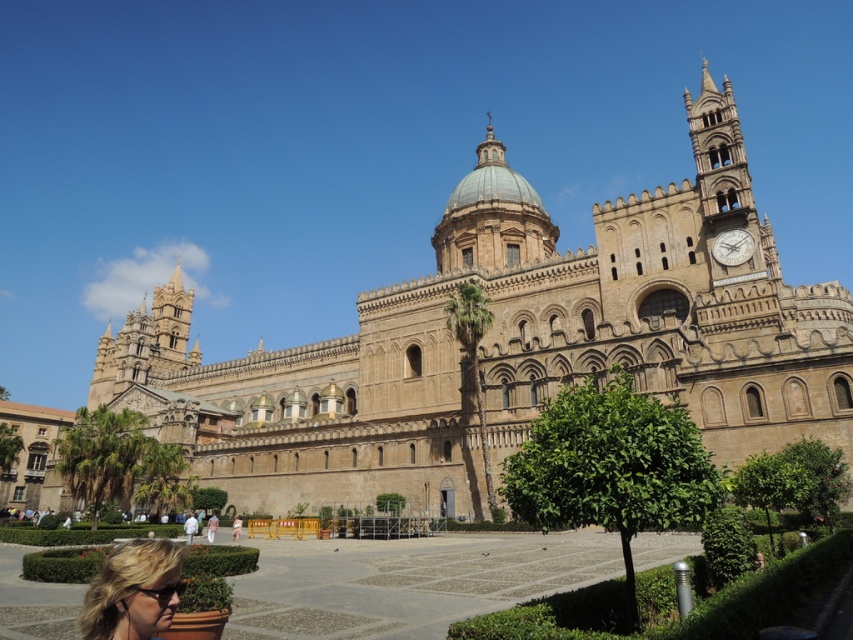
Is blonde hair at lower left positioned before pink fabric dress at lower center?

Yes, it is.

Does point (152, 556) come in front of point (236, 518)?

Yes, point (152, 556) is in front of point (236, 518).

Who is more forward, (131, 579) or (235, 528)?

Point (131, 579) is in front.

What are the coordinates of `blonde hair at lower left` in the screenshot? It's located at (132, 592).

Which is behind, point (94, 605) or point (738, 234)?

The point (738, 234) is behind.

Who is higher up, blonde hair at lower left or metallic silver clock at upper right?

metallic silver clock at upper right

Who is more forward, [164,621] or [741,252]?

Point [164,621] is in front.

You are a GUI agent. You are given a task and a screenshot of the screen. Output one action in this format:
    pyautogui.click(x=<x>, y=<y>)
    Task: Click on the blonde hair at lower left
    The image size is (853, 640).
    Given the screenshot: What is the action you would take?
    pyautogui.click(x=132, y=592)

Does white cotton shirt at lower center have a lesser height compared to pink fabric dress at lower center?

No, white cotton shirt at lower center is not shorter than pink fabric dress at lower center.

Who is positioned more to the right, white cotton shirt at lower center or pink fabric dress at lower center?

pink fabric dress at lower center

I want to click on white cotton shirt at lower center, so click(190, 528).